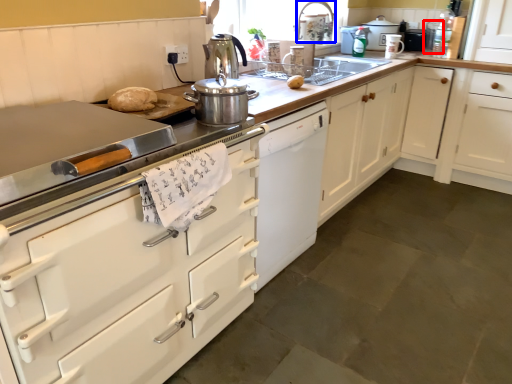
Question: Which object appears closest to the camera in this image, appliance (highlighted by a red box) or faucet (highlighted by a blue box)?

Choices:
 (A) appliance
 (B) faucet

Answer: (B)